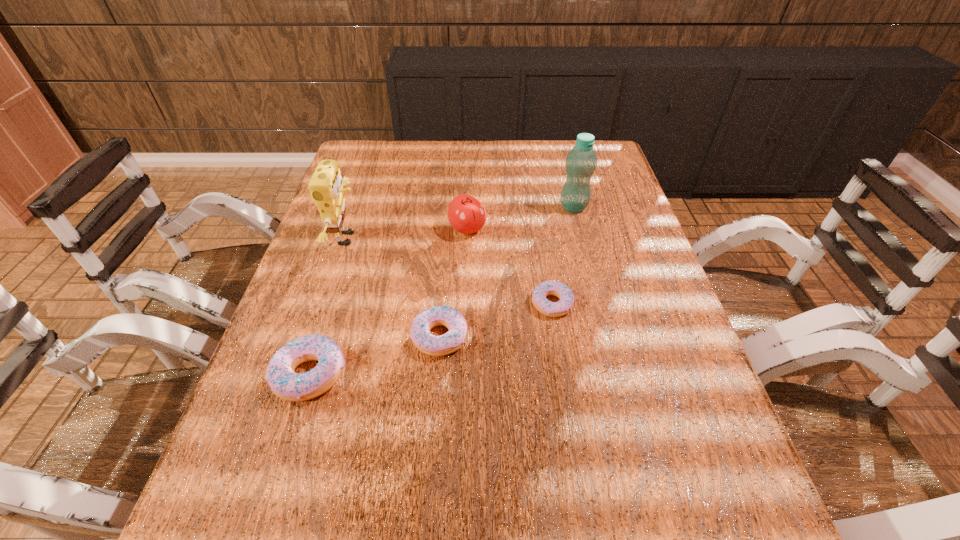
Locate an element on the screen. The width and height of the screenshot is (960, 540). free spot that satisfies the following two spatial constraints: 1. on the face of the second tallest doughnut; 2. on the right side of the sponge is located at coordinates tap(315, 337).

Image resolution: width=960 pixels, height=540 pixels. In order to click on vacant area in the image that satisfies the following two spatial constraints: 1. on the face of the sponge; 2. on the back side of the shortest doughnut in this screenshot , I will do `click(326, 304)`.